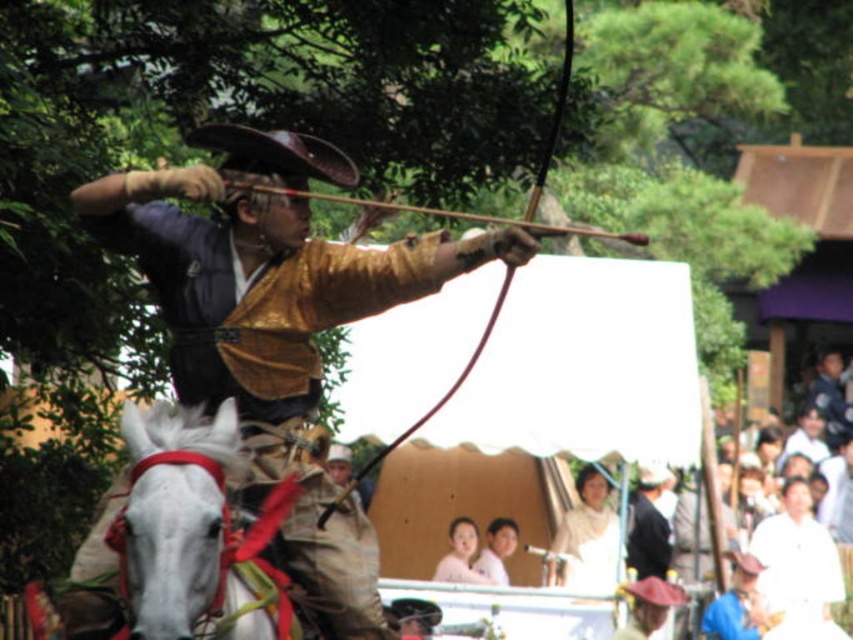
You are an archer preparing to shoot an arrow. You notice the white glossy horse at left and the smooth white face at center in your line of sight. Which object is positioned to the left of the other?

The white glossy horse at left is to the left of smooth white face at center.

You are a photographer standing at the front of the archery performance. You want to take a photo that includes both the archer and the crowd under the canopy. Which of the two points, point (x=212, y=548) or point (x=485, y=563), is closer to your camera lens?

Point (x=212, y=548) is closer to the camera than point (x=485, y=563).

You are a photographer at the event and want to capture the archer and the crowd. You notice two faces labeled as smooth skin face at center and smooth white face at center. Which face is closer to the camera?

The smooth skin face at center is positioned under the smooth white face at center, meaning it is closer to the camera.